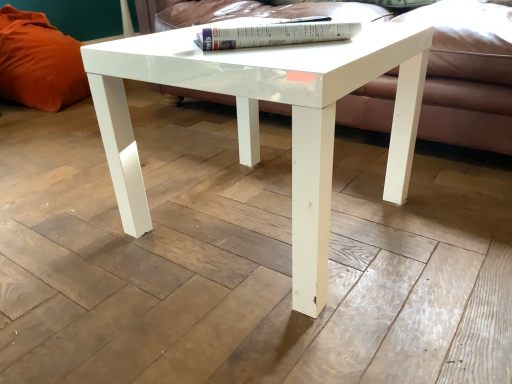
Where is `vacant space behind white glossy coffee table at center`? The image size is (512, 384). vacant space behind white glossy coffee table at center is located at coordinates (227, 148).